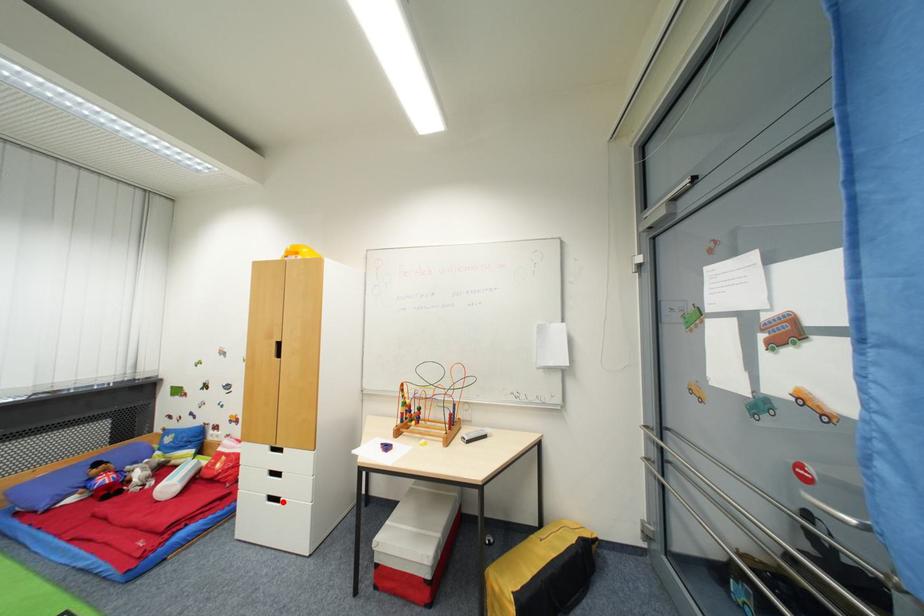
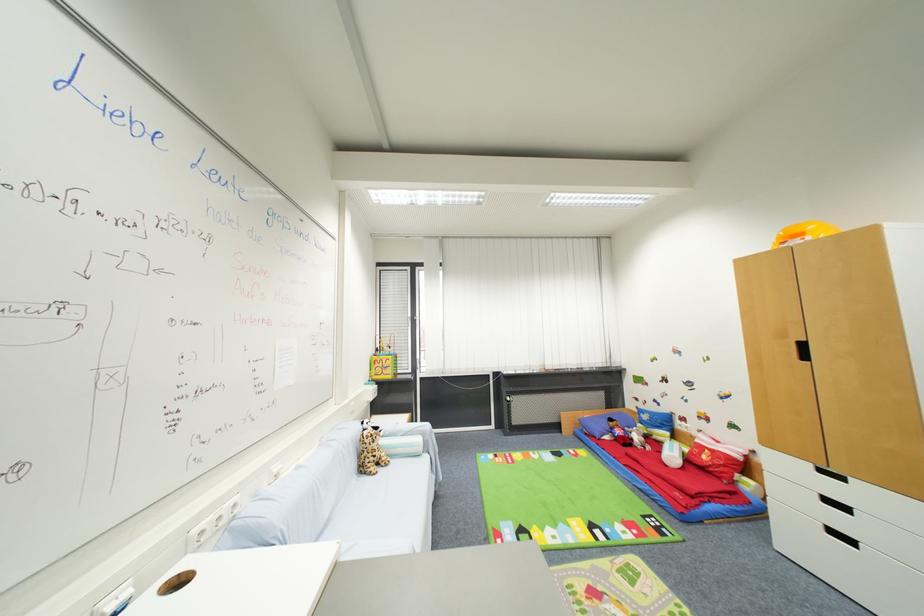
Where in the second image is the point corresponding to the highlighted location from the first image?

(857, 544)